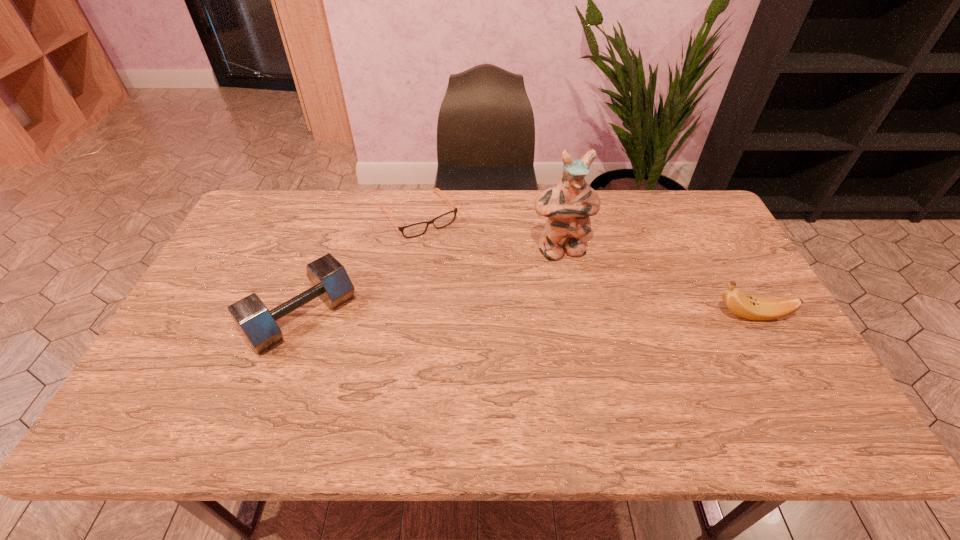
Identify the location of vacant spot on the desktop that is between the dumbbell and the banana and is positioned on the front-facing side of the spectacles. (493, 316).

Find the location of a particular element. This screenshot has width=960, height=540. free spot on the desktop that is between the dumbbell and the banana and is positioned on the front-facing side of the second object from right to left is located at coordinates (590, 316).